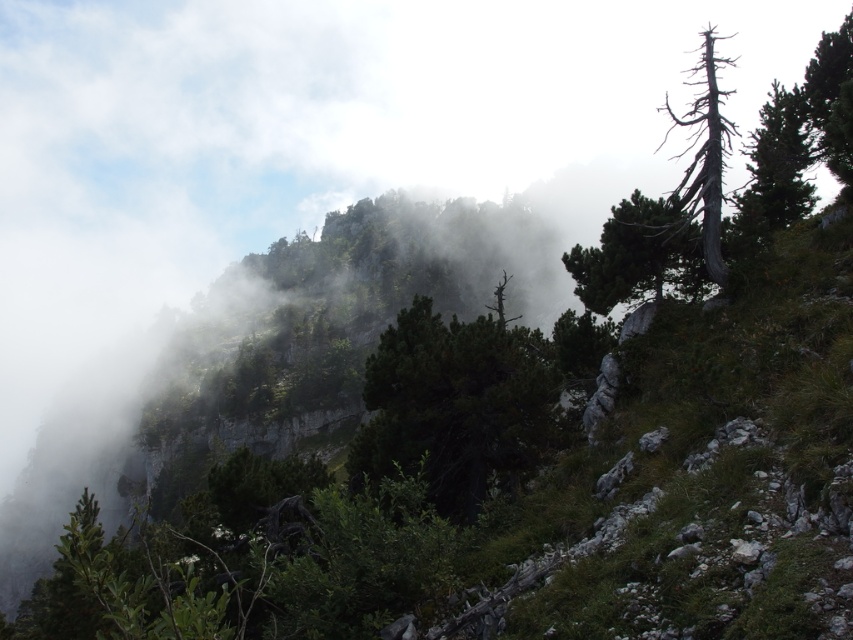
You are an environmental researcher studying the trees in this mountainous area. You observe the green textured pine tree at upper right and the charcoal gray bark tree at upper right. Which tree would you estimate to be younger based on their sizes?

The green textured pine tree at upper right has a smaller size compared to the charcoal gray bark tree at upper right. Generally, smaller trees are younger, so the green textured pine tree at upper right is likely younger.

You are a hiker who wants to take a photo of the green matte tree at upper right. Based on the scene description, where should you position yourself to capture the tree in the frame?

The green matte tree at upper right is located at coordinates point (x=639, y=253), so you should position yourself to aim your camera towards that specific coordinate to capture it in the frame.

You are a hiker trying to navigate through the misty mountain terrain. You notice two trees at the upper right corner of your view. Which tree would appear closer to you when looking at the green textured pine tree at upper right and the charcoal gray bark tree at upper right?

The green textured pine tree at upper right appears closer because the charcoal gray bark tree at upper right is positioned behind it.